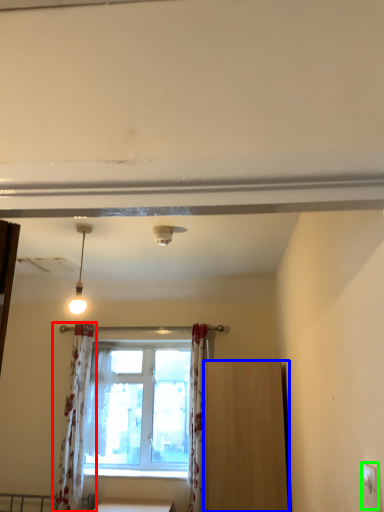
Question: Based on their relative distances, which object is farther from curtain (highlighted by a red box)? Choose from furniture (highlighted by a blue box) and electric outlet (highlighted by a green box).

Choices:
 (A) furniture
 (B) electric outlet

Answer: (B)